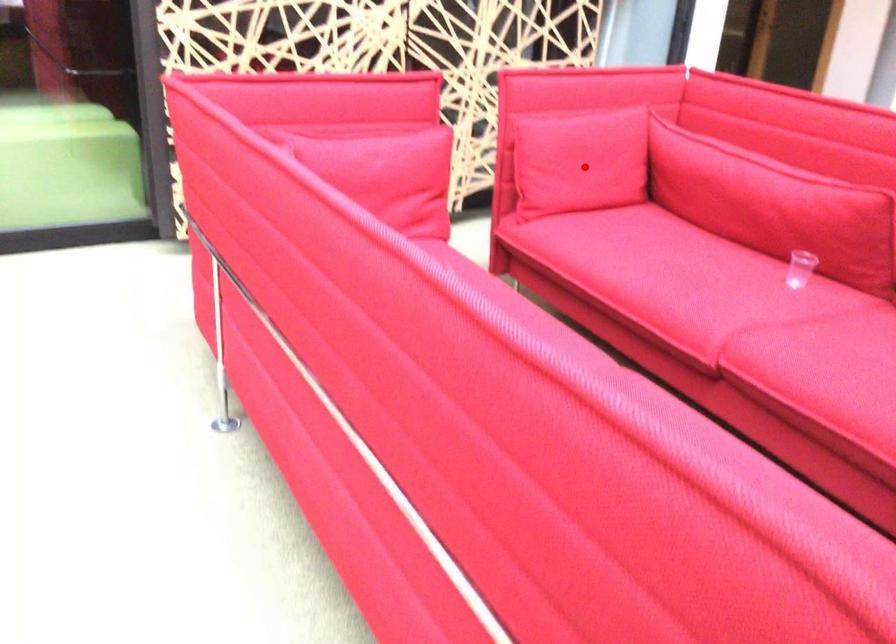
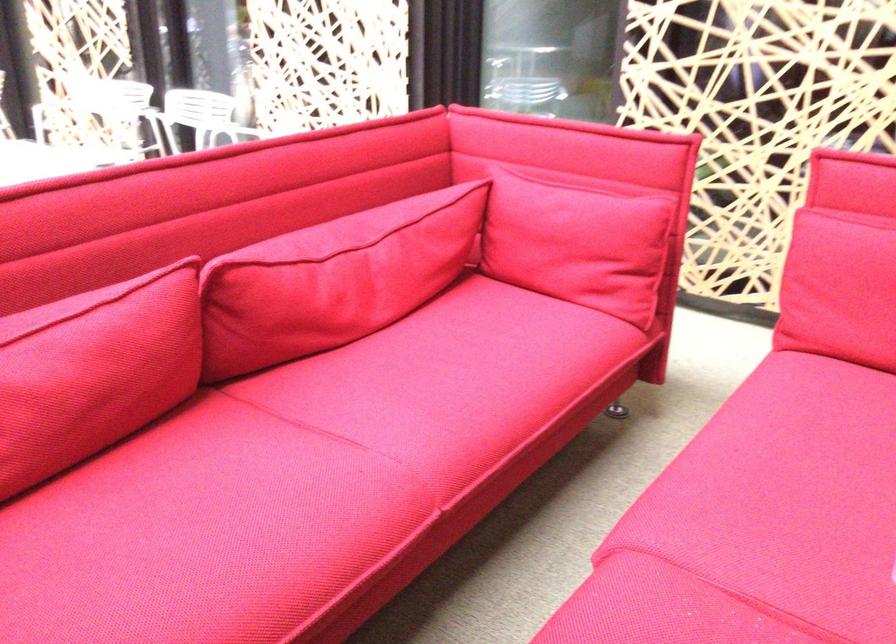
Question: A red point is marked in image1. In image2, is the corresponding 3D point closer to the camera or farther? Reply with the corresponding letter.

Choices:
 (A) The corresponding 3D point is closer.
 (B) The corresponding 3D point is farther.

Answer: (A)